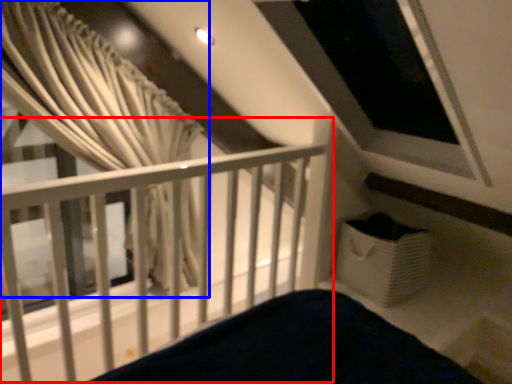
Question: Which object appears closest to the camera in this image, rail (highlighted by a red box) or curtain (highlighted by a blue box)?

Choices:
 (A) rail
 (B) curtain

Answer: (A)